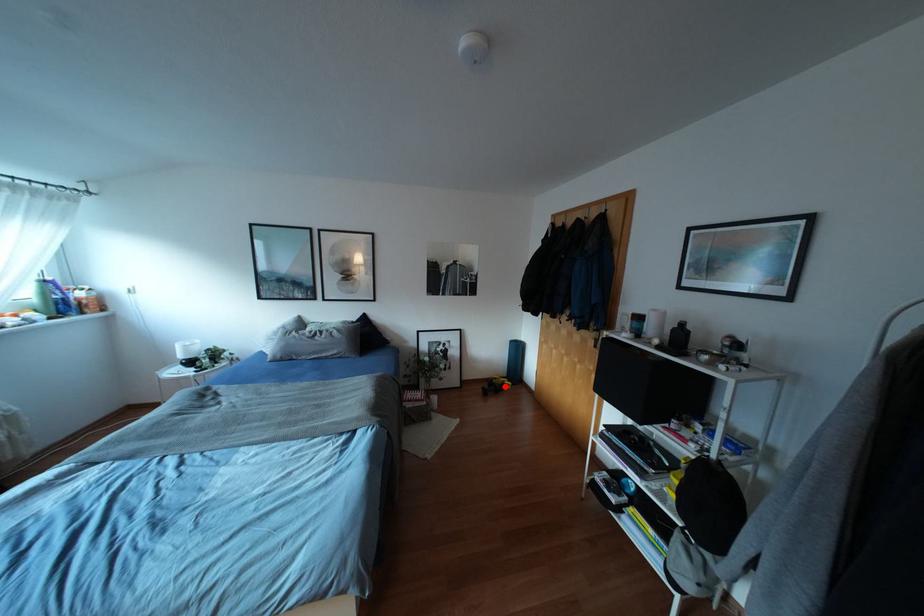
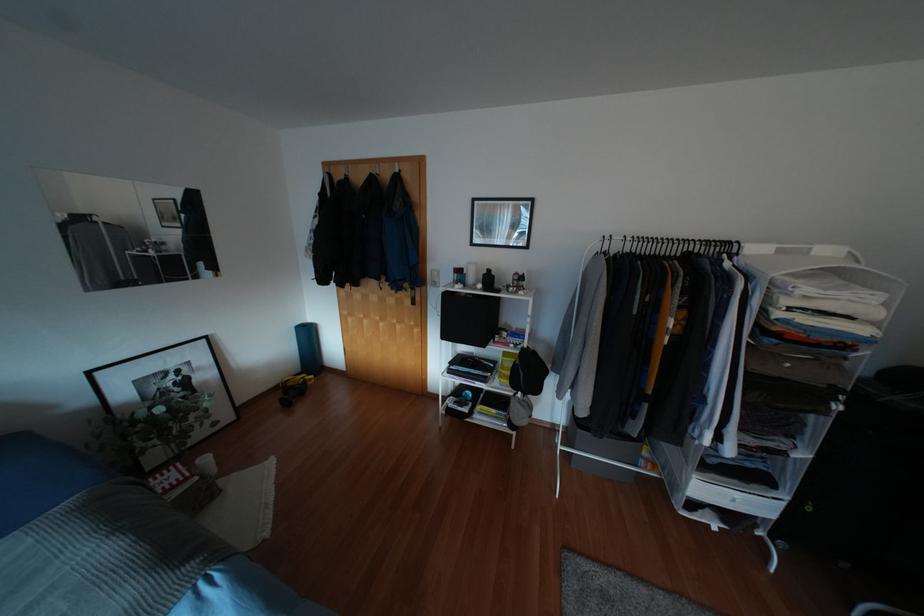
Question: I am providing you with two images of the same scene from different viewpoints. Image1 has a red point marked. In image2, the corresponding 3D location appears at what relative position? Reply with the corresponding letter.

Choices:
 (A) Closer
 (B) Farther

Answer: (B)